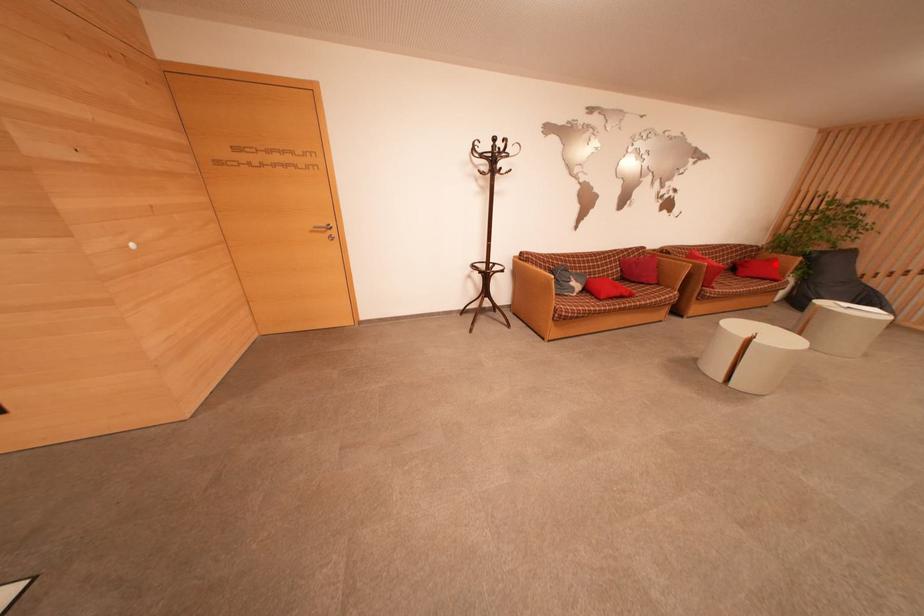
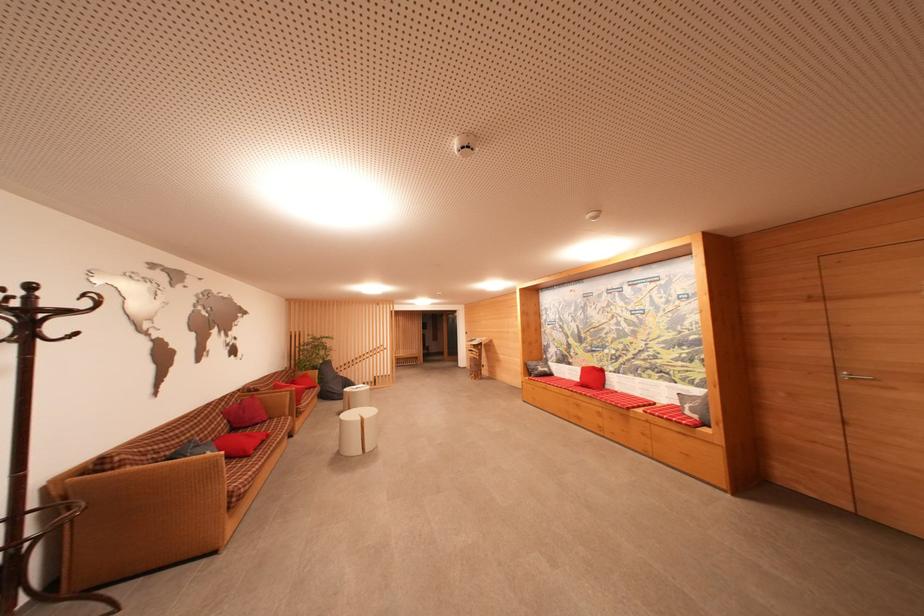
Question: I am providing you with two images of the same scene from different viewpoints. A red point is marked on the first image. Is the red point's position out of view in image 2?

Choices:
 (A) Yes
 (B) No

Answer: (B)